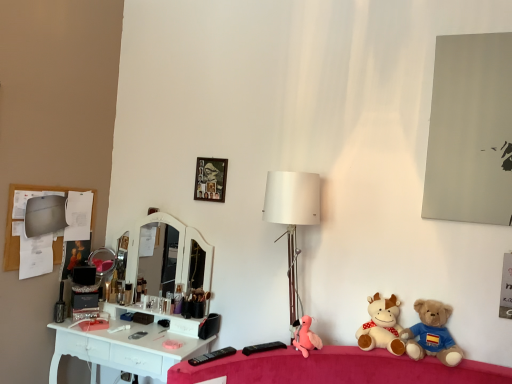
Question: Does brown plush bear at lower right, which is the 3th toy in left-to-right order, have a larger size compared to matte black makeup brush at left?

Choices:
 (A) no
 (B) yes

Answer: (B)

Question: Can you confirm if brown plush bear at lower right, which is the 3th toy in left-to-right order, is positioned to the right of matte black makeup brush at left?

Choices:
 (A) yes
 (B) no

Answer: (A)

Question: Is brown plush bear at lower right, which is the 3th toy in left-to-right order, wider than matte black makeup brush at left?

Choices:
 (A) yes
 (B) no

Answer: (A)

Question: From the image's perspective, does brown plush bear at lower right, which appears as the first toy when viewed from the right, appear higher than matte black makeup brush at left?

Choices:
 (A) no
 (B) yes

Answer: (A)

Question: From the image's perspective, is brown plush bear at lower right, which appears as the first toy when viewed from the right, beneath matte black makeup brush at left?

Choices:
 (A) yes
 (B) no

Answer: (A)

Question: Considering the positions of matte black makeup brush at left and pink plush at center, acting as the 3th toy starting from the right, in the image, is matte black makeup brush at left wider or thinner than pink plush at center, acting as the 3th toy starting from the right,?

Choices:
 (A) thin
 (B) wide

Answer: (A)

Question: Visually, is matte black makeup brush at left positioned to the left or to the right of pink plush at center, acting as the first toy starting from the left?

Choices:
 (A) right
 (B) left

Answer: (B)

Question: Is matte black makeup brush at left spatially inside pink plush at center, acting as the first toy starting from the left, or outside of it?

Choices:
 (A) inside
 (B) outside

Answer: (B)

Question: In terms of size, does matte black makeup brush at left appear bigger or smaller than pink plush at center, acting as the 3th toy starting from the right?

Choices:
 (A) small
 (B) big

Answer: (A)

Question: Considering the relative positions of pink plush at center, acting as the 3th toy starting from the right, and white matte table lamp at center in the image provided, is pink plush at center, acting as the 3th toy starting from the right, to the left or to the right of white matte table lamp at center?

Choices:
 (A) right
 (B) left

Answer: (A)

Question: Looking at their shapes, would you say pink plush at center, acting as the 3th toy starting from the right, is wider or thinner than white matte table lamp at center?

Choices:
 (A) wide
 (B) thin

Answer: (B)

Question: Is pink plush at center, acting as the 3th toy starting from the right, spatially inside white matte table lamp at center, or outside of it?

Choices:
 (A) inside
 (B) outside

Answer: (A)

Question: From the image's perspective, is pink plush at center, acting as the 3th toy starting from the right, above or below white matte table lamp at center?

Choices:
 (A) below
 (B) above

Answer: (A)

Question: Is soft plush cow at lower right, acting as the second toy starting from the right, in front of or behind matte gray mirror at upper right in the image?

Choices:
 (A) behind
 (B) front

Answer: (A)

Question: Does point (355, 337) appear closer or farther from the camera than point (436, 36)?

Choices:
 (A) closer
 (B) farther

Answer: (B)